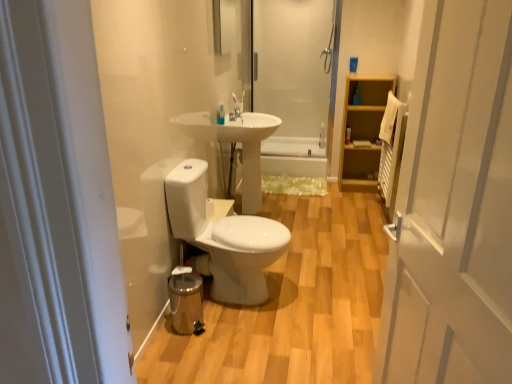
Question: Considering the relative positions of translucent plastic bottle at upper right, which is the 1th toiletry in right-to-left order, and transparent glass shower door at upper center in the image provided, is translucent plastic bottle at upper right, which is the 1th toiletry in right-to-left order, in front of transparent glass shower door at upper center?

Choices:
 (A) yes
 (B) no

Answer: (B)

Question: Considering the relative sizes of translucent plastic bottle at upper right, acting as the 2th toiletry starting from the front, and transparent glass shower door at upper center in the image provided, is translucent plastic bottle at upper right, acting as the 2th toiletry starting from the front, smaller than transparent glass shower door at upper center?

Choices:
 (A) no
 (B) yes

Answer: (B)

Question: Can you confirm if translucent plastic bottle at upper right, positioned as the 2th toiletry in left-to-right order, is shorter than transparent glass shower door at upper center?

Choices:
 (A) yes
 (B) no

Answer: (A)

Question: From a real-world perspective, does translucent plastic bottle at upper right, which is the 1th toiletry in right-to-left order, stand above transparent glass shower door at upper center?

Choices:
 (A) no
 (B) yes

Answer: (A)

Question: Can you confirm if translucent plastic bottle at upper right, which is the 1th toiletry in right-to-left order, is bigger than transparent glass shower door at upper center?

Choices:
 (A) no
 (B) yes

Answer: (A)

Question: Would you say white glossy toilet at center is to the left or to the right of white glossy toothbrush at upper center, the first toiletry positioned from the front, in the picture?

Choices:
 (A) right
 (B) left

Answer: (A)

Question: In terms of width, does white glossy toilet at center look wider or thinner when compared to white glossy toothbrush at upper center, which is counted as the second toiletry, starting from the back?

Choices:
 (A) thin
 (B) wide

Answer: (B)

Question: From the image's perspective, is white glossy toilet at center located above or below white glossy toothbrush at upper center, which is counted as the second toiletry, starting from the back?

Choices:
 (A) below
 (B) above

Answer: (A)

Question: Considering the positions of point (360, 220) and point (221, 124), is point (360, 220) closer or farther from the camera than point (221, 124)?

Choices:
 (A) farther
 (B) closer

Answer: (A)

Question: Is transparent glass shower door at upper center taller or shorter than white glossy toilet at center?

Choices:
 (A) tall
 (B) short

Answer: (A)

Question: From a real-world perspective, is transparent glass shower door at upper center physically located above or below white glossy toilet at center?

Choices:
 (A) below
 (B) above

Answer: (B)

Question: Considering the positions of point [x=306, y=135] and point [x=377, y=243], is point [x=306, y=135] closer or farther from the camera than point [x=377, y=243]?

Choices:
 (A) farther
 (B) closer

Answer: (A)

Question: In the image, is transparent glass shower door at upper center on the left side or the right side of white glossy toilet at center?

Choices:
 (A) right
 (B) left

Answer: (B)

Question: From the image's perspective, is light wood cabinet at right located above or below white glossy door at right?

Choices:
 (A) below
 (B) above

Answer: (B)

Question: Considering their positions, is light wood cabinet at right located in front of or behind white glossy door at right?

Choices:
 (A) front
 (B) behind

Answer: (B)